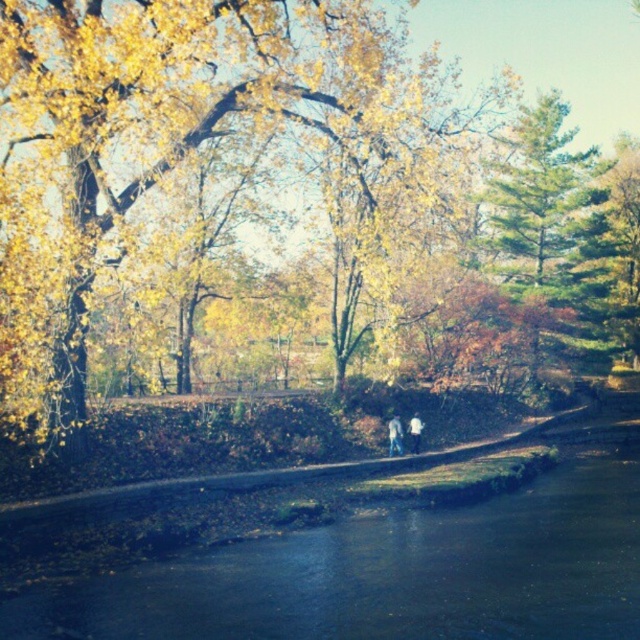
Is point (390, 438) more distant than point (396, 429)?

No, it is in front of (396, 429).

Is point (396, 422) more distant than point (394, 432)?

Yes, point (396, 422) is behind point (394, 432).

What are the coordinates of `light blue jeans at center` in the screenshot? It's located at (394, 435).

Does dark blue water at center appear over light blue jeans at center?

Incorrect, dark blue water at center is not positioned above light blue jeans at center.

Looking at this image, can you confirm if dark blue water at center is positioned to the left of light blue jeans at center?

No, dark blue water at center is not to the left of light blue jeans at center.

Describe the element at coordinates (388, 573) in the screenshot. Image resolution: width=640 pixels, height=640 pixels. I see `dark blue water at center` at that location.

Where is `dark blue water at center`? dark blue water at center is located at coordinates (388, 573).

Is point (410, 448) farther from camera compared to point (410, 429)?

No, it is in front of (410, 429).

Is light blue jeans at center wider than white matte shirt at center?

Yes.

Which is in front, point (397, 440) or point (417, 422)?

Point (397, 440) is in front.

At what (x,y) coordinates should I click in order to perform the action: click on light blue jeans at center. Please return your answer as a coordinate pair (x, y). Looking at the image, I should click on (394, 435).